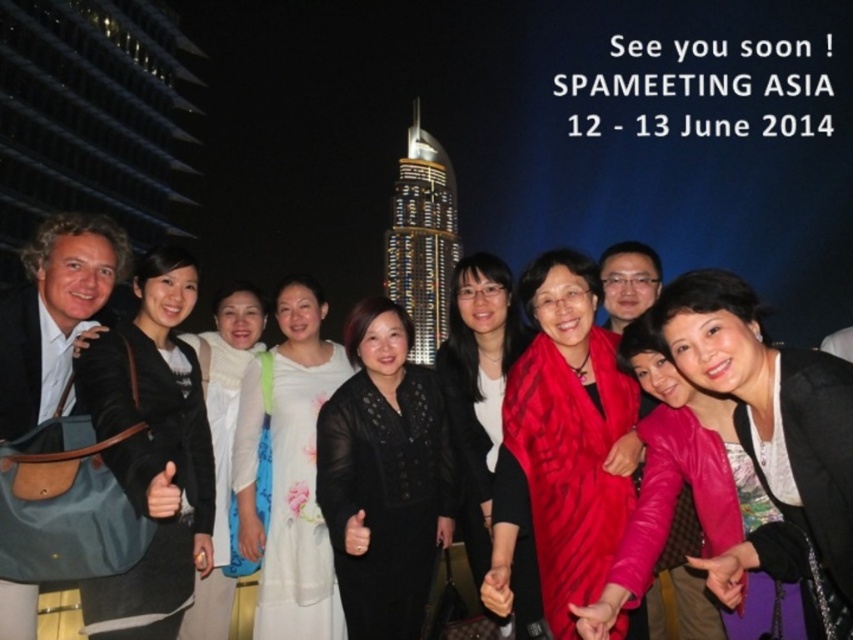
Can you confirm if pink leather jacket at center is positioned below matte black jacket at left?

Indeed, pink leather jacket at center is positioned under matte black jacket at left.

Is pink leather jacket at center to the right of matte black jacket at left from the viewer's perspective?

Indeed, pink leather jacket at center is positioned on the right side of matte black jacket at left.

Is point (808, 573) less distant than point (199, 396)?

That is True.

Locate an element on the screen. The width and height of the screenshot is (853, 640). pink leather jacket at center is located at coordinates (773, 442).

In the scene shown: Is red silk scarf at center shorter than matte black jacket at left?

Incorrect, red silk scarf at center's height does not fall short of matte black jacket at left's.

Between red silk scarf at center and matte black jacket at left, which one has less height?

With less height is matte black jacket at left.

Where is `red silk scarf at center`? The image size is (853, 640). red silk scarf at center is located at coordinates (563, 444).

Can you confirm if red silk scarf at center is positioned above white floral dress at center?

Indeed, red silk scarf at center is positioned over white floral dress at center.

Is point (576, 448) positioned before point (263, 632)?

Yes, point (576, 448) is closer to viewer.

Locate an element on the screen. red silk scarf at center is located at coordinates (563, 444).